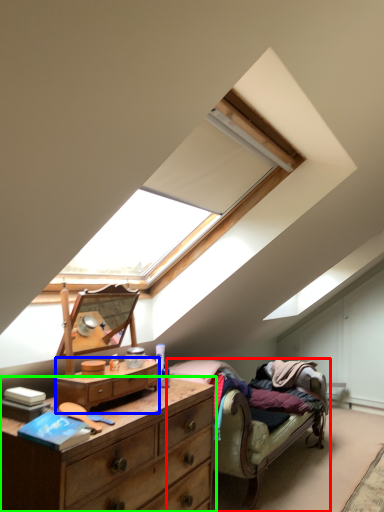
Question: Based on their relative distances, which object is nearer to studio couch (highlighted by a red box)? Choose from chest of drawers (highlighted by a blue box) and chest of drawers (highlighted by a green box).

Choices:
 (A) chest of drawers
 (B) chest of drawers

Answer: (B)